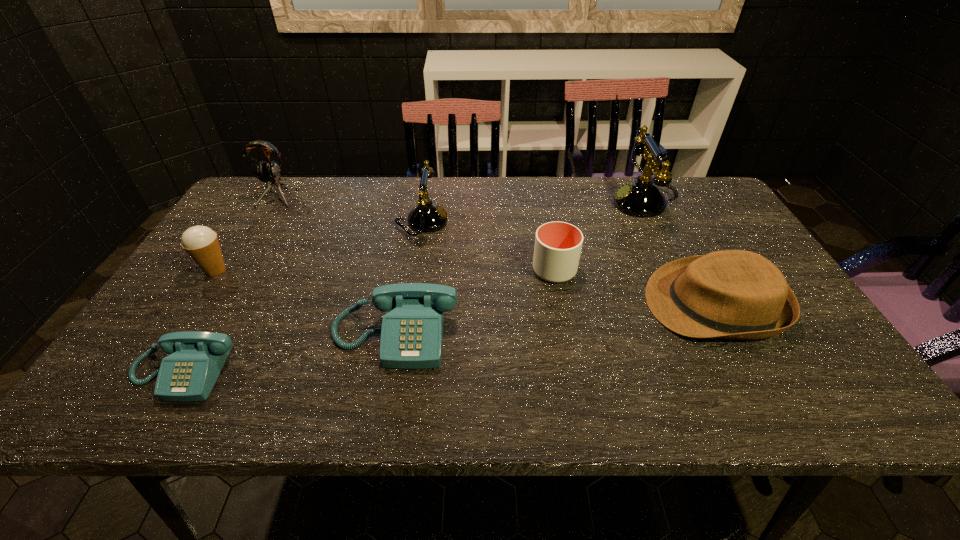
Identify the location of vacant region located 0.090m on the front-facing side of the fedora. (610, 305).

Locate an element on the screen. The width and height of the screenshot is (960, 540). free region located on the front-facing side of the fedora is located at coordinates (531, 305).

Find the location of a particular element. This screenshot has height=540, width=960. blank space located 0.110m on the front-facing side of the fedora is located at coordinates (602, 305).

Find the location of a particular element. earphone that is at the far edge is located at coordinates (266, 172).

The height and width of the screenshot is (540, 960). Identify the location of object that is at the near edge. (189, 373).

Where is `earphone located in the left edge section of the desktop`? This screenshot has height=540, width=960. earphone located in the left edge section of the desktop is located at coordinates (x=266, y=172).

This screenshot has width=960, height=540. I want to click on icecream located at the left edge, so click(201, 243).

The image size is (960, 540). In order to click on telephone at the left edge in this screenshot , I will do `click(189, 373)`.

Locate an element on the screen. telephone that is at the right edge is located at coordinates click(641, 198).

Identify the location of fedora that is at the right edge. (731, 294).